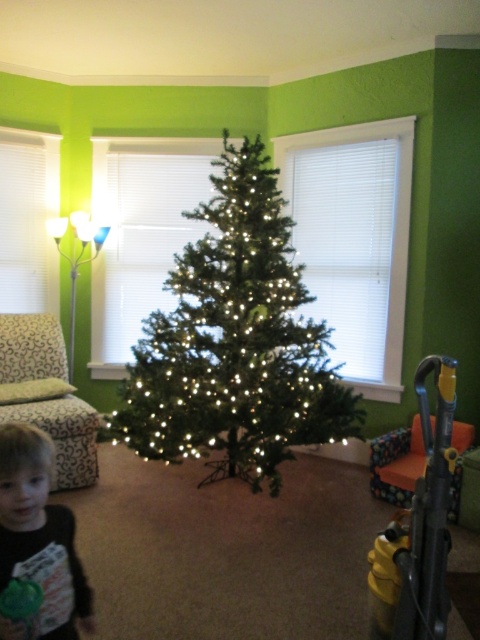
Question: Does green matte christmas tree at center appear on the left side of smooth brown shirt at lower left?

Choices:
 (A) yes
 (B) no

Answer: (B)

Question: Which object appears farthest from the camera in this image?

Choices:
 (A) smooth brown shirt at lower left
 (B) green matte christmas tree at center

Answer: (B)

Question: Is green matte christmas tree at center positioned at the back of smooth brown shirt at lower left?

Choices:
 (A) no
 (B) yes

Answer: (B)

Question: Does green matte christmas tree at center appear over smooth brown shirt at lower left?

Choices:
 (A) yes
 (B) no

Answer: (A)